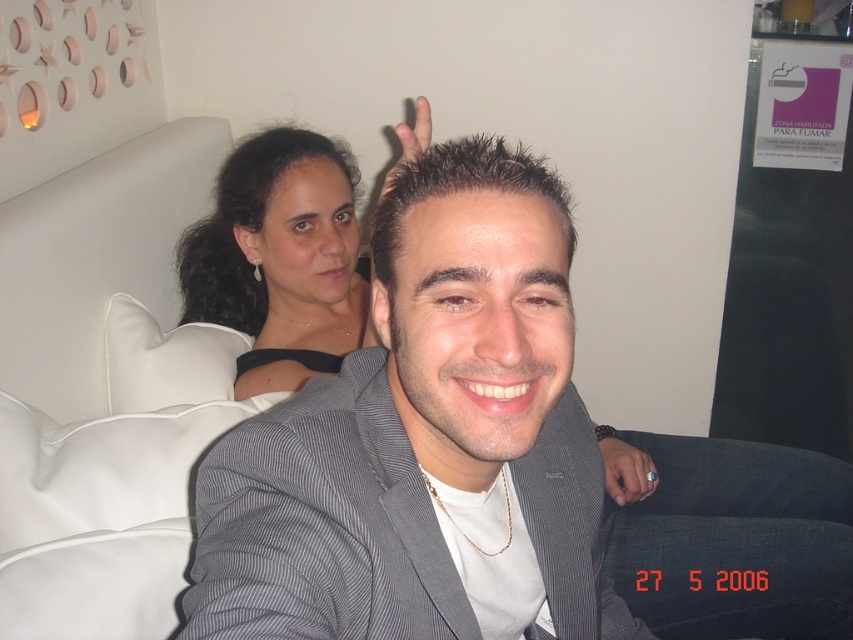
You are a photographer trying to capture a closeup shot of the matte black hand at upper center. However, the white fabric pillow at upper left is blocking your view. Can you move the pillow to the right to get an unobstructed view of the hand?

The white fabric pillow at upper left is to the left of the matte black hand at upper center. Moving the pillow to the right would place it directly under the hand, potentially still blocking the view. To ensure an unobstructed view, you should move the pillow further to the right or adjust its position so it no longer overlaps with the hand.

You are a photographer setting up for a portrait session. You need to ensure that the white fabric pillow at upper left and the gold ring at center are both in focus. The camera you are using has a depth of field that can cover objects within a 60 cm range. Can both objects be in focus simultaneously?

The distance between the white fabric pillow at upper left and the gold ring at center is 58.03 centimeters, which is within the camera lens depth of field range of 60 cm. Therefore, both objects can be in focus simultaneously.

You are a photographer setting up a shoot in this scene. You need to ensure that the matte black dress at upper left and the gold ring at center are both visible in the frame. Given their sizes, which object might require you to adjust your camera angle to include it properly?

The matte black dress at upper left is wider than the gold ring at center, so it might require adjusting the camera angle to ensure it fits within the frame.